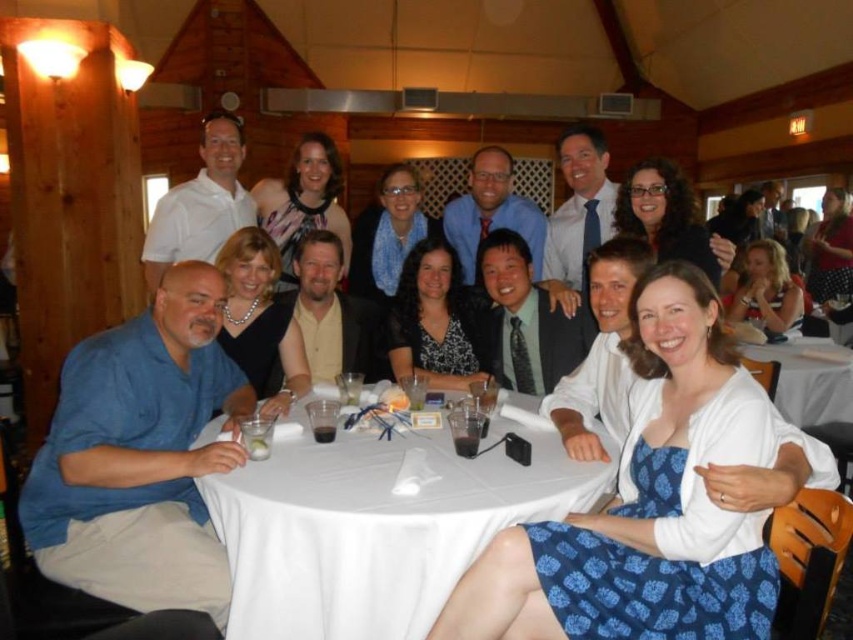
You are a photographer at the event and need to adjust the lighting to highlight the white cloth at center and the white cloth at lower right. Since both are white, how can you tell which cloth is closer to the camera?

The white cloth at center is closer to the camera because it is in front of the white cloth at lower right.

You are a photographer taking a picture of the group around the round table. The camera is positioned at point 0.825, 0.441. Where should you focus to ensure the white cloth at center is in sharp focus?

The white cloth at center is located at point [375,528], so focusing the camera at that coordinate will ensure it is in sharp focus.

You are a photographer setting up for a group photo. The scene has a white cloth at center and a white cloth at lower right. Which cloth should you focus on if you want to capture the one closer to the camera?

The white cloth at center is shorter than white cloth at lower right, so the white cloth at center is closer to the camera. You should focus on the white cloth at center.